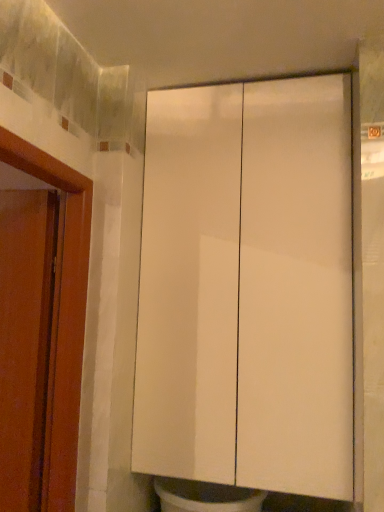
Question: Would you say white glossy cabinet at center is inside or outside matte wood door at left?

Choices:
 (A) outside
 (B) inside

Answer: (A)

Question: Is point click(x=281, y=225) positioned closer to the camera than point click(x=34, y=471)?

Choices:
 (A) closer
 (B) farther

Answer: (B)

Question: In terms of width, does white glossy cabinet at center look wider or thinner when compared to matte wood door at left?

Choices:
 (A) thin
 (B) wide

Answer: (B)

Question: Is point (28, 409) positioned closer to the camera than point (337, 391)?

Choices:
 (A) farther
 (B) closer

Answer: (B)

Question: Is matte wood door at left to the left or to the right of white glossy cabinet at center in the image?

Choices:
 (A) right
 (B) left

Answer: (B)

Question: Based on their sizes in the image, would you say matte wood door at left is bigger or smaller than white glossy cabinet at center?

Choices:
 (A) small
 (B) big

Answer: (A)

Question: From the image's perspective, is matte wood door at left positioned above or below white glossy cabinet at center?

Choices:
 (A) below
 (B) above

Answer: (A)